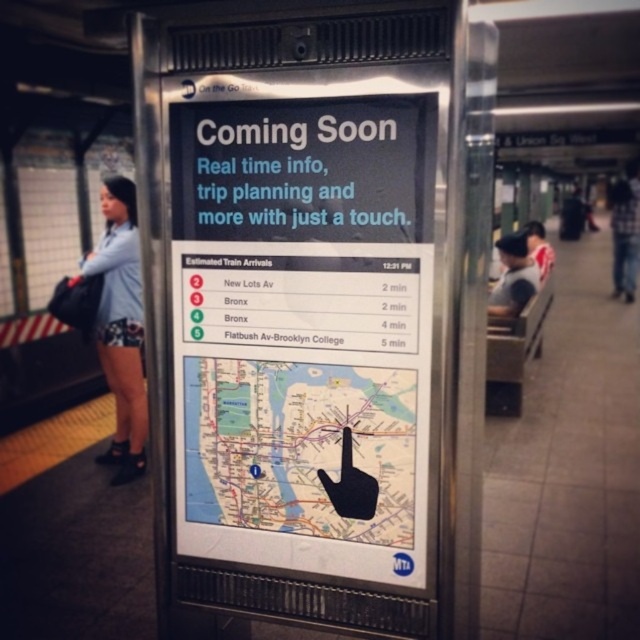
Question: Which object is the closest to the denim shorts at left?

Choices:
 (A) dark gray shirt at center
 (B) matte map at center

Answer: (B)

Question: Among these points, which one is nearest to the camera?

Choices:
 (A) (285, 529)
 (B) (532, 264)
 (C) (106, 381)

Answer: (A)

Question: Is denim shorts at left closer to camera compared to dark gray shirt at center?

Choices:
 (A) no
 (B) yes

Answer: (A)

Question: Can you confirm if matte map at center is positioned to the right of dark gray shirt at center?

Choices:
 (A) yes
 (B) no

Answer: (B)

Question: Which point is farther from the camera taking this photo?

Choices:
 (A) (376, 500)
 (B) (506, 304)
 (C) (140, 288)

Answer: (C)

Question: Does matte map at center come behind dark gray shirt at center?

Choices:
 (A) no
 (B) yes

Answer: (A)